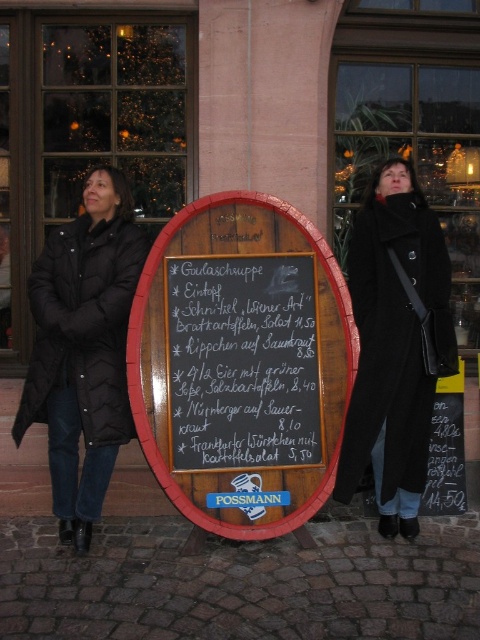
Is black chalkboard at center thinner than black chalkboard menu at center?

Incorrect, black chalkboard at center's width is not less than black chalkboard menu at center's.

Between black chalkboard at center and black chalkboard menu at center, which one appears on the left side from the viewer's perspective?

Positioned to the left is black chalkboard menu at center.

The image size is (480, 640). I want to click on black chalkboard at center, so click(241, 364).

Can you confirm if black chalkboard at center is positioned below black wool coat at center?

Yes, black chalkboard at center is below black wool coat at center.

Which is behind, point (196, 488) or point (371, 381)?

The point (371, 381) is more distant.

Which is behind, point (303, 298) or point (405, 477)?

Point (405, 477)

Where is `black chalkboard at center`? The width and height of the screenshot is (480, 640). black chalkboard at center is located at coordinates (241, 364).

Does black chalkboard menu at center appear under black puffer coat at left?

Yes.

Between black chalkboard menu at center and black puffer coat at left, which one has more height?

Standing taller between the two is black puffer coat at left.

Identify the location of black chalkboard menu at center. The image size is (480, 640). (242, 362).